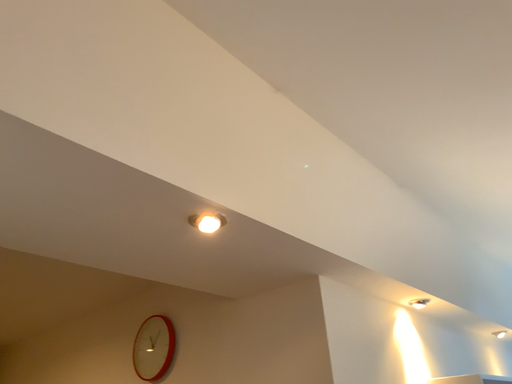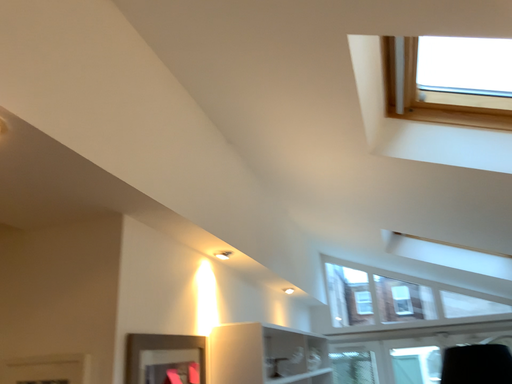
Question: How did the camera likely rotate when shooting the video?

Choices:
 (A) rotated left
 (B) rotated right

Answer: (B)